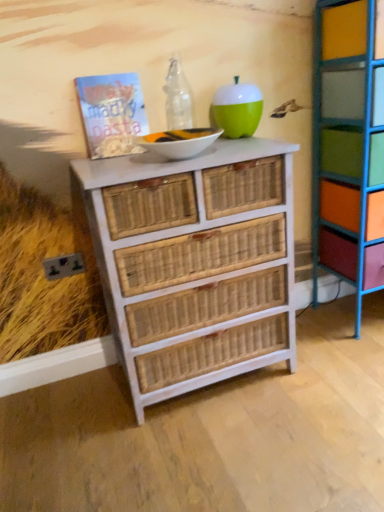
Identify the location of free spot in front of white wicker chest of drawers at center. (218, 454).